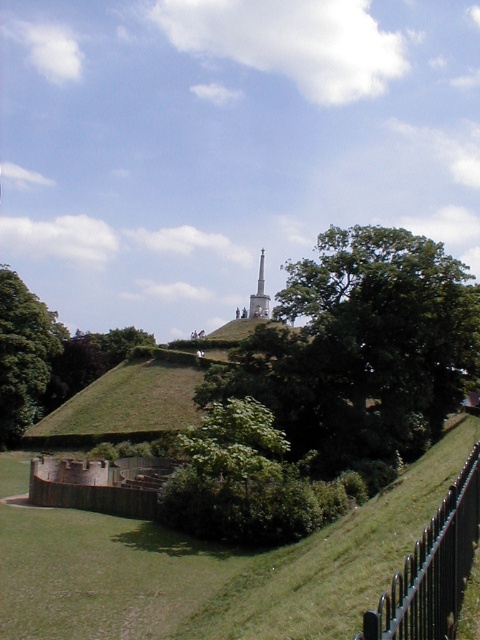
Can you confirm if green leafy tree at upper center is bigger than white marble tower at center?

Yes, green leafy tree at upper center is bigger than white marble tower at center.

This screenshot has height=640, width=480. What are the coordinates of `green leafy tree at upper center` in the screenshot? It's located at (361, 348).

Is black metal fence at lower right positioned at the back of green leafy tree at left?

No, it is in front of green leafy tree at left.

Is black metal fence at lower right closer to the viewer compared to green leafy tree at left?

Yes, it is.

Is point (434, 541) less distant than point (3, 304)?

Yes, point (434, 541) is in front of point (3, 304).

This screenshot has width=480, height=640. Identify the location of black metal fence at lower right. (432, 568).

Is the position of green leafy tree at left more distant than that of white marble tower at center?

No, green leafy tree at left is in front of white marble tower at center.

Is point (34, 353) in front of point (254, 298)?

That is True.

This screenshot has width=480, height=640. Find the location of `green leafy tree at left`. green leafy tree at left is located at coordinates (24, 355).